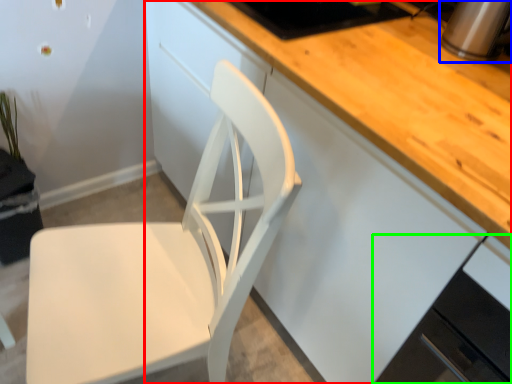
Question: Which is farther away from cabinetry (highlighted by a red box)? appliance (highlighted by a blue box) or cabinetry (highlighted by a green box)?

Choices:
 (A) appliance
 (B) cabinetry

Answer: (A)